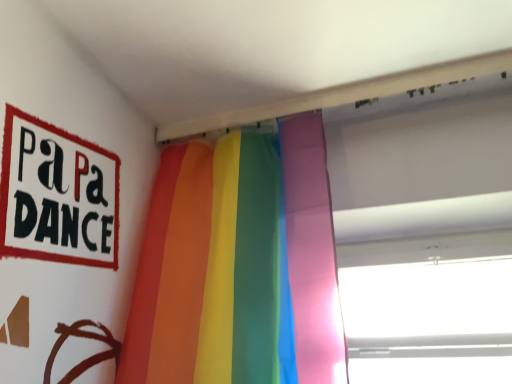
Measure the distance between transparent plastic window at upper right and camera.

transparent plastic window at upper right is 3.89 feet away from camera.

Image resolution: width=512 pixels, height=384 pixels. What do you see at coordinates (429, 309) in the screenshot? I see `transparent plastic window at upper right` at bounding box center [429, 309].

Locate an element on the screen. Image resolution: width=512 pixels, height=384 pixels. transparent plastic window at upper right is located at coordinates (429, 309).

Locate an element on the screen. The height and width of the screenshot is (384, 512). rainbow fabric curtain at center is located at coordinates (239, 265).

This screenshot has width=512, height=384. What do you see at coordinates (239, 265) in the screenshot? I see `rainbow fabric curtain at center` at bounding box center [239, 265].

You are a GUI agent. You are given a task and a screenshot of the screen. Output one action in this format:
    pyautogui.click(x=<x>, y=<y>)
    Task: Click on the transparent plastic window at upper right
    This screenshot has width=512, height=384.
    Given the screenshot: What is the action you would take?
    pyautogui.click(x=429, y=309)

Would you say rainbow fabric curtain at center is to the left or to the right of transparent plastic window at upper right in the picture?

In the image, rainbow fabric curtain at center appears on the left side of transparent plastic window at upper right.

Considering the positions of objects rainbow fabric curtain at center and transparent plastic window at upper right in the image provided, who is behind, rainbow fabric curtain at center or transparent plastic window at upper right?

Positioned behind is transparent plastic window at upper right.

Is point (296, 253) closer or farther from the camera than point (354, 278)?

Point (296, 253).

From the image's perspective, is rainbow fabric curtain at center beneath transparent plastic window at upper right?

Incorrect, from the image's perspective, rainbow fabric curtain at center is higher than transparent plastic window at upper right.

From a real-world perspective, between rainbow fabric curtain at center and transparent plastic window at upper right, who is vertically lower?

In real-world perspective, transparent plastic window at upper right is lower.

Considering the relative sizes of rainbow fabric curtain at center and transparent plastic window at upper right in the image provided, is rainbow fabric curtain at center wider than transparent plastic window at upper right?

No.

In terms of height, does rainbow fabric curtain at center look taller or shorter compared to transparent plastic window at upper right?

Clearly, rainbow fabric curtain at center is taller compared to transparent plastic window at upper right.

In terms of size, does rainbow fabric curtain at center appear bigger or smaller than transparent plastic window at upper right?

Clearly, rainbow fabric curtain at center is smaller in size than transparent plastic window at upper right.

Is transparent plastic window at upper right completely or partially inside rainbow fabric curtain at center?

Actually, transparent plastic window at upper right is outside rainbow fabric curtain at center.

Looking at this image, is rainbow fabric curtain at center directly adjacent to transparent plastic window at upper right?

rainbow fabric curtain at center and transparent plastic window at upper right are clearly separated.

Is rainbow fabric curtain at center oriented away from transparent plastic window at upper right?

No.

In order to click on window behind the rainbow fabric curtain at center in this screenshot , I will do `click(429, 309)`.

Visually, is transparent plastic window at upper right positioned to the left or to the right of rainbow fabric curtain at center?

From the image, it's evident that transparent plastic window at upper right is to the right of rainbow fabric curtain at center.

Does transparent plastic window at upper right come in front of rainbow fabric curtain at center?

That is False.

Which point is more distant from viewer, (360, 329) or (277, 316)?

The point (360, 329) is farther from the camera.

From the image's perspective, which is below, transparent plastic window at upper right or rainbow fabric curtain at center?

transparent plastic window at upper right is shown below in the image.

From a real-world perspective, is transparent plastic window at upper right positioned above or below rainbow fabric curtain at center?

In terms of real-world spatial position, transparent plastic window at upper right is below rainbow fabric curtain at center.

Considering the sizes of transparent plastic window at upper right and rainbow fabric curtain at center in the image, is transparent plastic window at upper right wider or thinner than rainbow fabric curtain at center?

Clearly, transparent plastic window at upper right has more width compared to rainbow fabric curtain at center.

Can you confirm if transparent plastic window at upper right is taller than rainbow fabric curtain at center?

No.

In terms of size, does transparent plastic window at upper right appear bigger or smaller than rainbow fabric curtain at center?

In the image, transparent plastic window at upper right appears to be larger than rainbow fabric curtain at center.

Is transparent plastic window at upper right not inside rainbow fabric curtain at center?

transparent plastic window at upper right is positioned outside rainbow fabric curtain at center.

Would you say transparent plastic window at upper right is a long distance from rainbow fabric curtain at center?

That's not correct — transparent plastic window at upper right is a little close to rainbow fabric curtain at center.

From the picture: Is transparent plastic window at upper right facing away from rainbow fabric curtain at center?

transparent plastic window at upper right does not have its back to rainbow fabric curtain at center.

Locate an element on the screen. window behind the rainbow fabric curtain at center is located at coordinates (429, 309).

The width and height of the screenshot is (512, 384). Identify the location of curtain to the left of transparent plastic window at upper right. (239, 265).

Identify the location of curtain that is above the transparent plastic window at upper right (from the image's perspective). The image size is (512, 384). (239, 265).